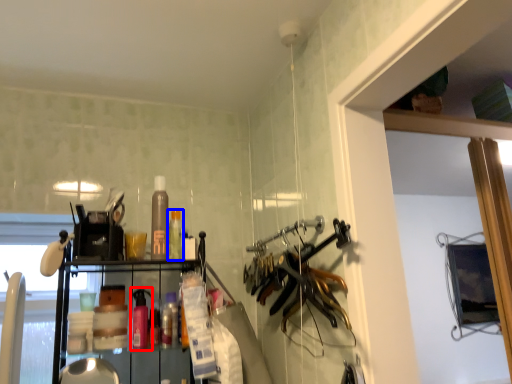
Question: Which point is further to the camera, bottle (highlighted by a red box) or bottle (highlighted by a blue box)?

Choices:
 (A) bottle
 (B) bottle

Answer: (B)